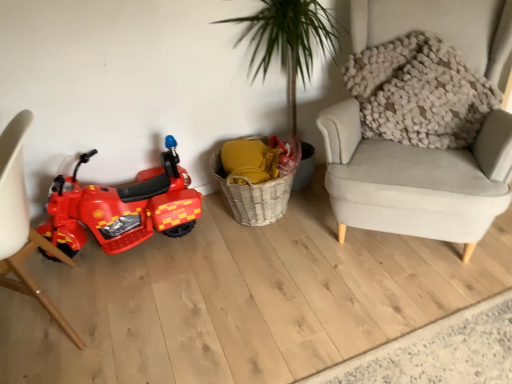
Find the location of a particular element. vacant space underneath matte white chair at left (from a real-world perspective) is located at coordinates (58, 314).